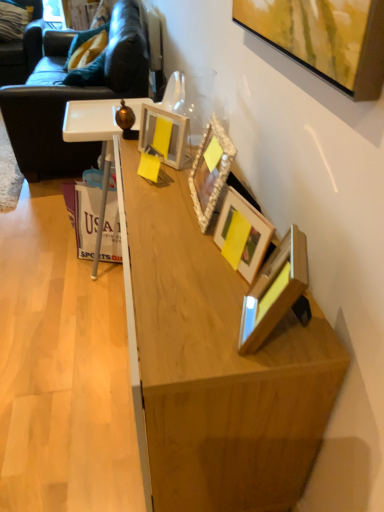
The width and height of the screenshot is (384, 512). Find the location of `vacant space to the left of silver textured picture frame at upper right, arranged as the third picture frame when viewed from the front`. vacant space to the left of silver textured picture frame at upper right, arranged as the third picture frame when viewed from the front is located at coordinates (159, 209).